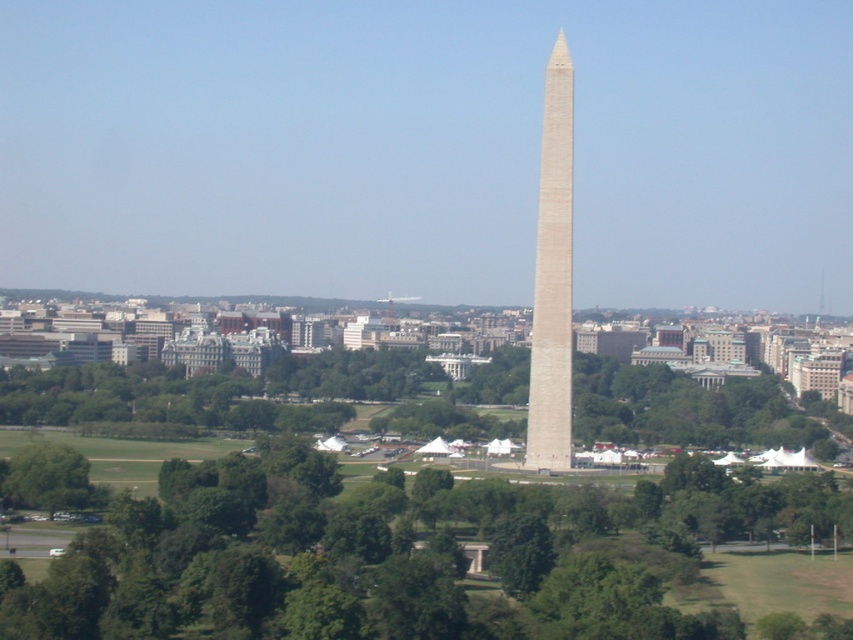
You are standing at the base of the Washington Monument and looking towards the foreground. You notice two green leafy trees in the scene. Which tree, the green leafy tree at center or the green leafy tree at lower left, appears closer to you based on their positions?

The green leafy tree at center appears closer because it is positioned below the green leafy tree at lower left, indicating it is nearer to the observer.

You are standing in the field near the Washington Monument and want to take a photo that includes both the green leafy tree at center and the beige stone obelisk at center. Which object should you position to your left to frame the shot properly?

To frame the shot properly, position the green leafy tree at center to your left since it is already on the left side of the beige stone obelisk at center.